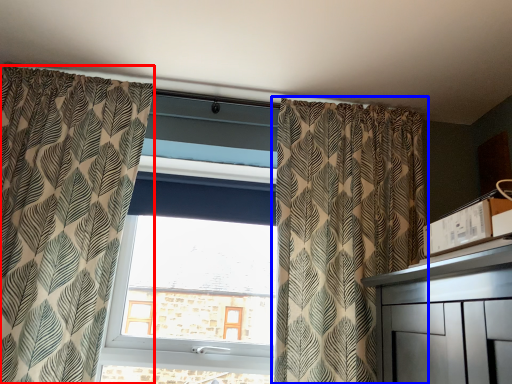
Question: Among these objects, which one is farthest to the camera, curtain (highlighted by a red box) or curtain (highlighted by a blue box)?

Choices:
 (A) curtain
 (B) curtain

Answer: (B)